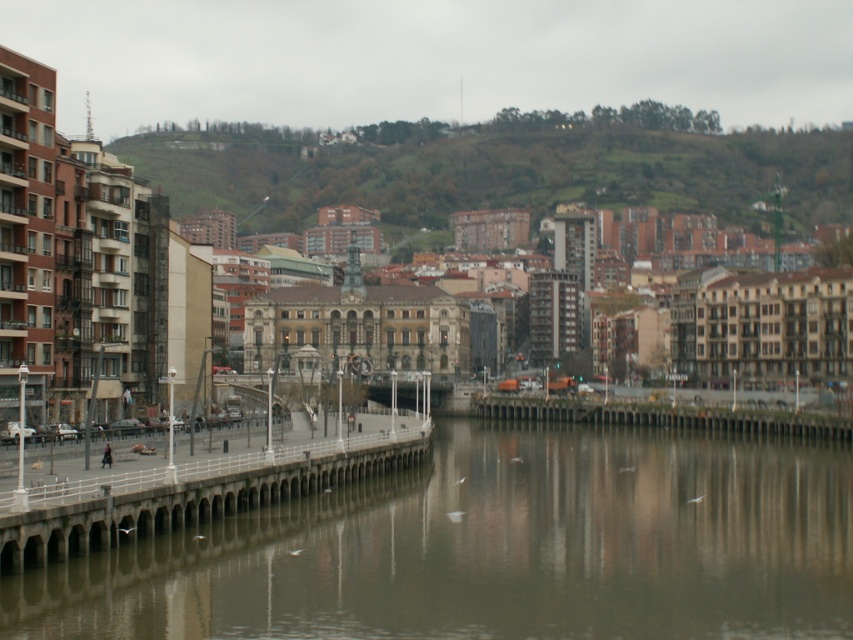
You are a city planner reviewing this waterfront area. You need to determine which of the two structures, the smooth concrete river at center or the concrete bridge at center, requires more maintenance based on their sizes. Which one would you prioritize?

The smooth concrete river at center is larger in size than the concrete bridge at center, so it would require more maintenance and should be prioritized.

You are a tourist standing on the walkway and want to take a photo of both the smooth concrete river at center and the concrete bridge at center. Which object should you position to your left to include both in the frame?

You should position the smooth concrete river at center to your left since it is located on the left side of the concrete bridge at center, allowing both to be captured in the photo.

You are standing on the concrete dock at lower left and want to reach the green grassy hillside at upper center. Which direction should you move to get there?

You should move to the right from the concrete dock at lower left to reach the green grassy hillside at upper center since it is located to the right of the dock.